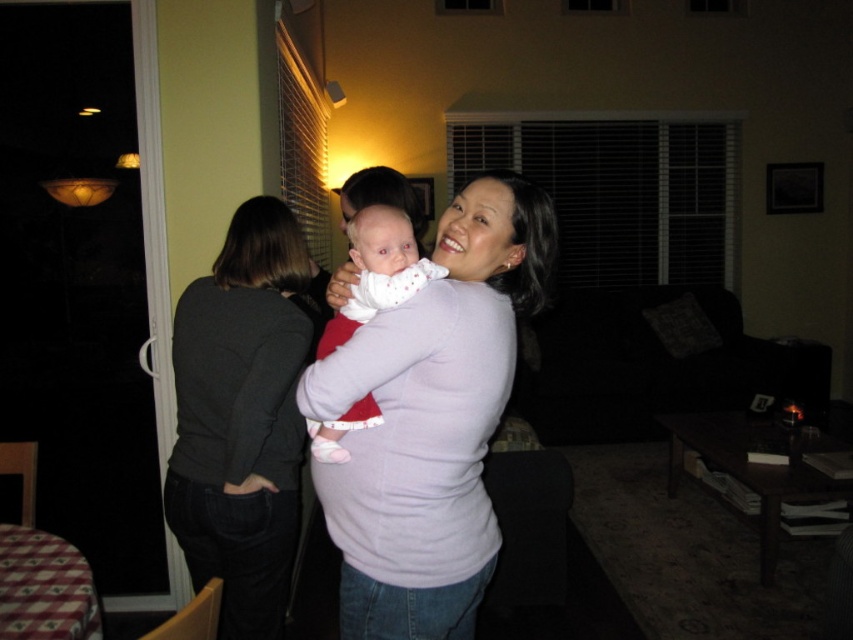
Question: Where is matte pink shirt at center located in relation to white soft fabric baby at center in the image?

Choices:
 (A) left
 (B) right

Answer: (B)

Question: Does matte black sleeve at upper center appear under white soft fabric baby at center?

Choices:
 (A) no
 (B) yes

Answer: (B)

Question: Which of the following is the farthest from the observer?

Choices:
 (A) white soft fabric baby at center
 (B) matte pink shirt at center
 (C) matte black sleeve at upper center

Answer: (C)

Question: Among these points, which one is farthest from the camera?

Choices:
 (A) (328, 330)
 (B) (277, 344)

Answer: (B)

Question: Is matte pink shirt at center behind dark gray sweater at left?

Choices:
 (A) no
 (B) yes

Answer: (A)

Question: Among these points, which one is nearest to the camera?

Choices:
 (A) (276, 355)
 (B) (519, 289)
 (C) (352, 292)
 (D) (222, 544)

Answer: (C)